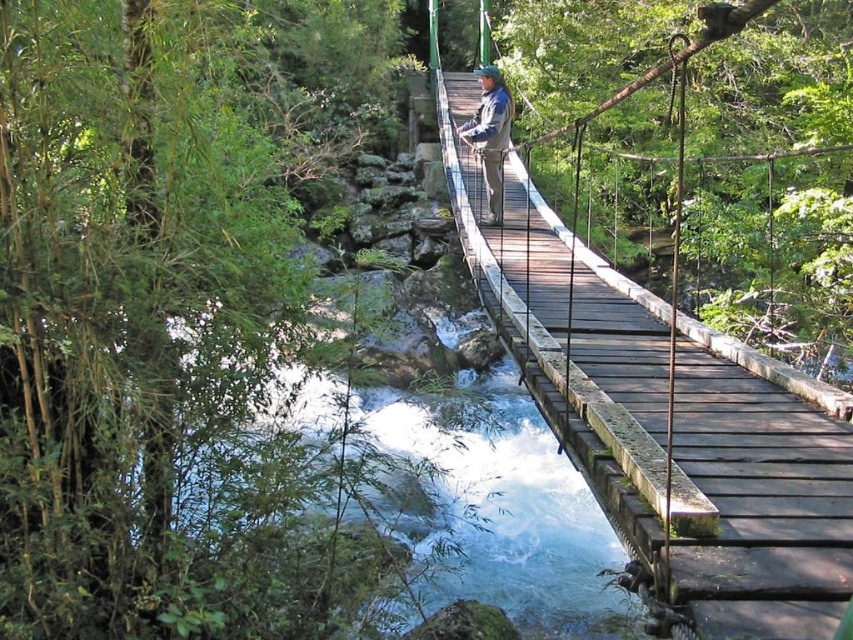
Does wooden bridge at center have a greater width compared to blue denim jacket at center?

Indeed, wooden bridge at center has a greater width compared to blue denim jacket at center.

Can you confirm if wooden bridge at center is taller than blue denim jacket at center?

Yes.

Is point (689, 525) closer to viewer compared to point (477, 72)?

Yes.

Image resolution: width=853 pixels, height=640 pixels. What are the coordinates of `wooden bridge at center` in the screenshot? It's located at (662, 419).